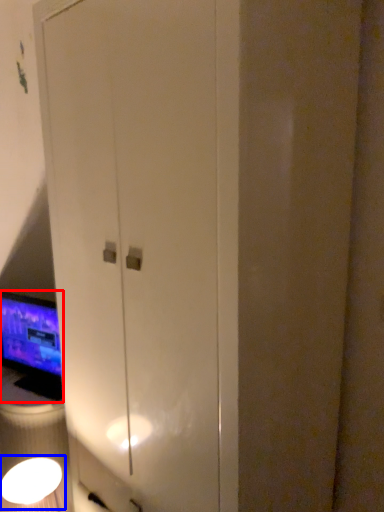
Question: Which point is closer to the camera, computer monitor (highlighted by a red box) or light fixture (highlighted by a blue box)?

Choices:
 (A) computer monitor
 (B) light fixture

Answer: (B)